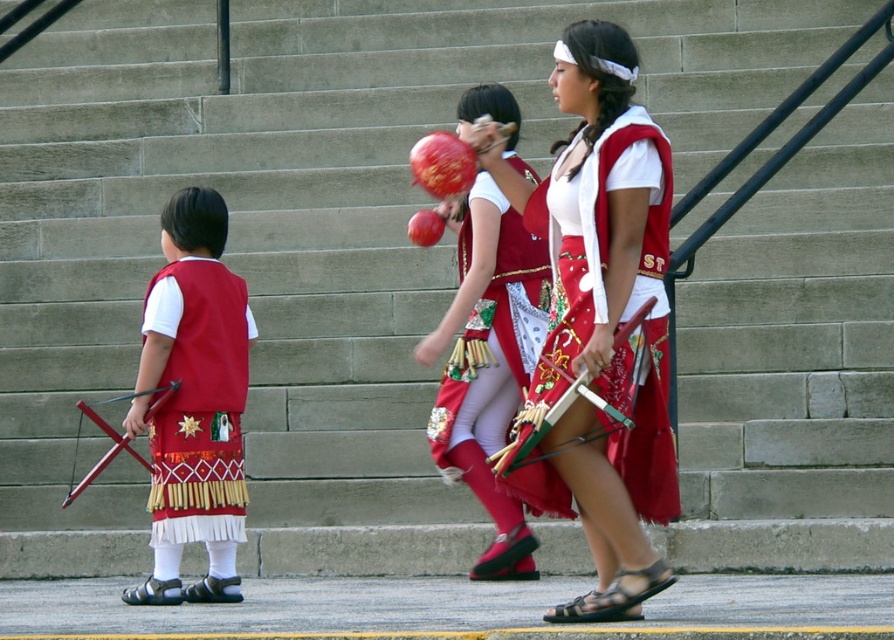
Question: Does matte red vest at center have a lesser width compared to matte red vest at left?

Choices:
 (A) yes
 (B) no

Answer: (B)

Question: Does matte red vest at center have a lesser width compared to matte red vest at left?

Choices:
 (A) no
 (B) yes

Answer: (A)

Question: Which object appears farthest from the camera in this image?

Choices:
 (A) shiny red vest at center
 (B) matte red vest at left
 (C) matte red vest at center

Answer: (A)

Question: Is matte red vest at left below shiny red vest at center?

Choices:
 (A) no
 (B) yes

Answer: (B)

Question: Which object is farther from the camera taking this photo?

Choices:
 (A) matte red vest at left
 (B) shiny red vest at center

Answer: (B)

Question: Which of the following is the closest to the observer?

Choices:
 (A) (190, 276)
 (B) (562, 61)

Answer: (B)